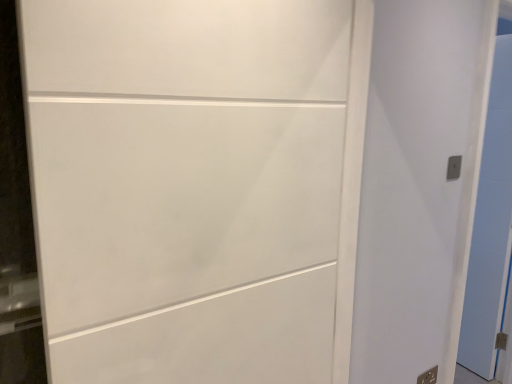
Question: Is white matte door at center, placed as the first door when sorted from front to back, not within metallic silver electric outlet at upper right, placed as the second electric outlet when sorted from bottom to top?

Choices:
 (A) no
 (B) yes

Answer: (B)

Question: Are white matte door at center, the 1th door viewed from the left, and metallic silver electric outlet at upper right, which is the second electric outlet from back to front, making contact?

Choices:
 (A) no
 (B) yes

Answer: (A)

Question: From a real-world perspective, is white matte door at center, placed as the 3th door when sorted from back to front, located beneath metallic silver electric outlet at upper right, the first electric outlet positioned from the front?

Choices:
 (A) no
 (B) yes

Answer: (B)

Question: Can you confirm if white matte door at center, the 1th door viewed from the left, is positioned to the left of metallic silver electric outlet at upper right, which is the 1th electric outlet from top to bottom?

Choices:
 (A) yes
 (B) no

Answer: (A)

Question: Does white matte door at center, the 1th door viewed from the left, turn towards metallic silver electric outlet at upper right, which is the second electric outlet from back to front?

Choices:
 (A) no
 (B) yes

Answer: (A)

Question: From the image's perspective, is white matte door at center, placed as the 3th door when sorted from back to front, below metallic silver electric outlet at upper right, which is the second electric outlet from back to front?

Choices:
 (A) yes
 (B) no

Answer: (A)

Question: Does white glossy door at right, marked as the first door in a right-to-left arrangement, have a smaller size compared to metallic silver electric outlet at upper right, which is the 1th electric outlet from top to bottom?

Choices:
 (A) no
 (B) yes

Answer: (A)

Question: From the image's perspective, is white glossy door at right, the third door positioned from the front, above metallic silver electric outlet at upper right, which is the second electric outlet from back to front?

Choices:
 (A) yes
 (B) no

Answer: (B)

Question: Considering the relative sizes of white glossy door at right, marked as the first door in a right-to-left arrangement, and metallic silver electric outlet at upper right, which is the 1th electric outlet from top to bottom, in the image provided, is white glossy door at right, marked as the first door in a right-to-left arrangement, thinner than metallic silver electric outlet at upper right, which is the 1th electric outlet from top to bottom,?

Choices:
 (A) no
 (B) yes

Answer: (A)

Question: Can you confirm if white glossy door at right, the 1th door when ordered from back to front, is bigger than metallic silver electric outlet at upper right, which is the second electric outlet from back to front?

Choices:
 (A) yes
 (B) no

Answer: (A)

Question: Is white glossy door at right, the third door positioned from the front, oriented away from metallic silver electric outlet at upper right, placed as the second electric outlet when sorted from bottom to top?

Choices:
 (A) yes
 (B) no

Answer: (B)

Question: Could you tell me if white glossy door at right, the third door positioned from the front, is turned towards metallic silver electric outlet at upper right, which is the 1th electric outlet from top to bottom?

Choices:
 (A) no
 (B) yes

Answer: (A)

Question: Is white glossy door at right, marked as the first door in a right-to-left arrangement, in front of white matte door at center, the 3th door positioned from the right?

Choices:
 (A) yes
 (B) no

Answer: (B)